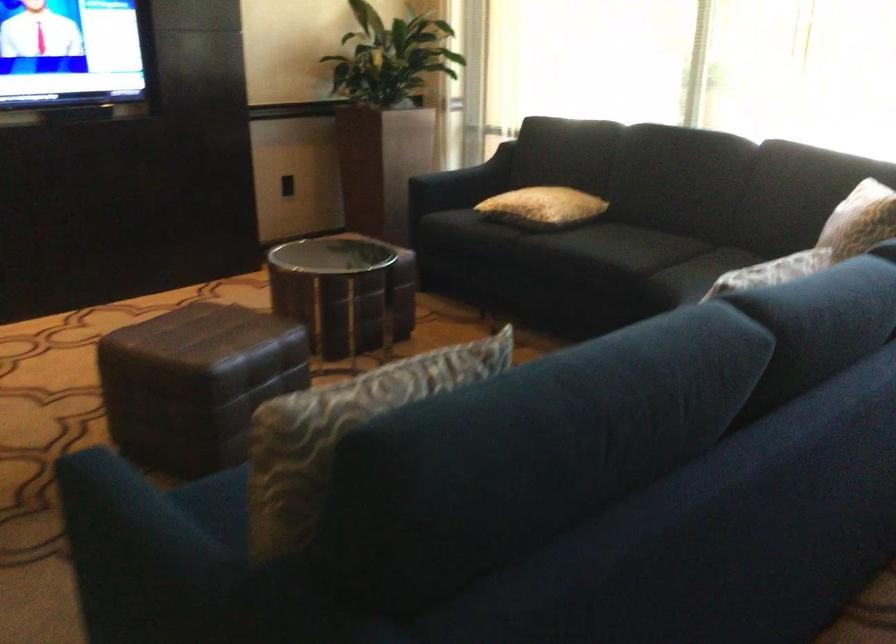
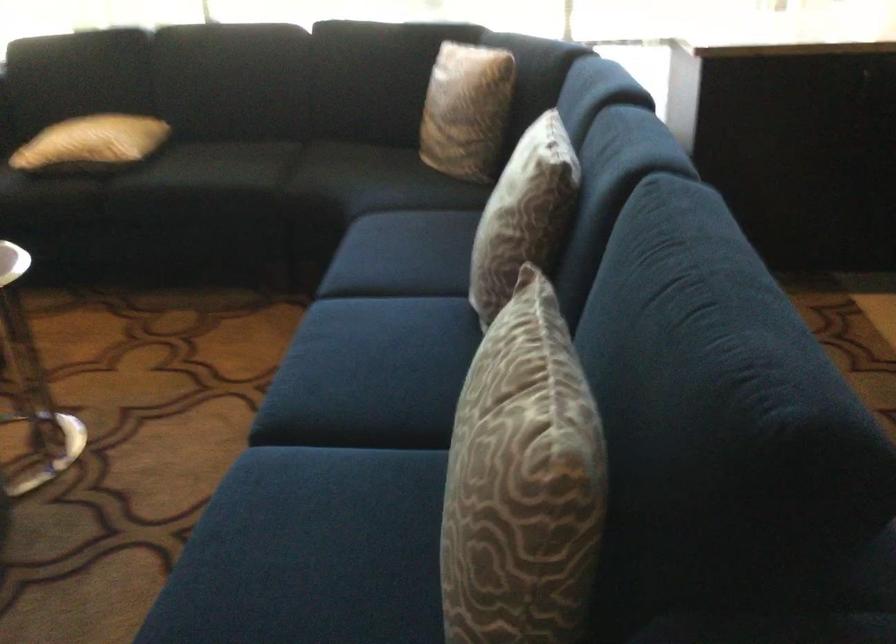
In the second image, find the point that corresponds to the point at 530,202 in the first image.

(91, 142)